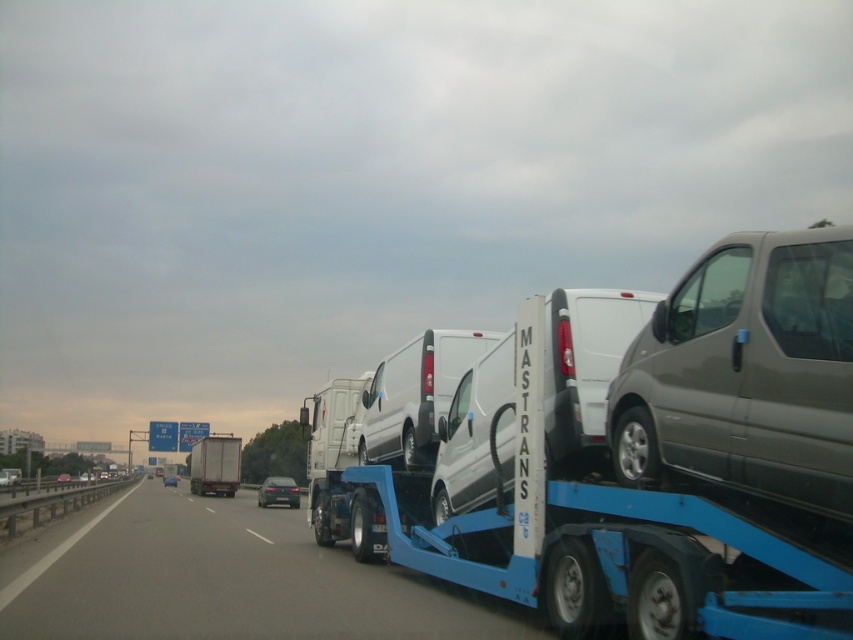
You are a delivery driver who needs to deliver a package to a specific location marked by the point at coordinates (x=746, y=372). You are currently driving the red rear section of the truck. Which van on the blue trailer with

The point at coordinates (x=746, y=372) is located on the matte gray van at right, so you should deliver the package to the matte gray van at right.

Consider the image. You are a photographer trying to capture the shiny black sedan at center and the matte gray van at right in a single shot. Based on their heights, which vehicle should you position closer to the camera to ensure both are fully visible in the frame?

Since the matte gray van at right is not as tall as the shiny black sedan at center, you should position the matte gray van at right closer to the camera to ensure both vehicles are fully visible in the frame.

Looking at this image, you are a driver trying to overtake the vehicles on the highway. You see a blue metallic truck at center and a shiny black sedan at center. Which vehicle should you overtake first if you want to pass both as quickly as possible?

You should overtake the shiny black sedan at center first because the blue metallic truck at center is wider, making it harder to pass safely and quickly.